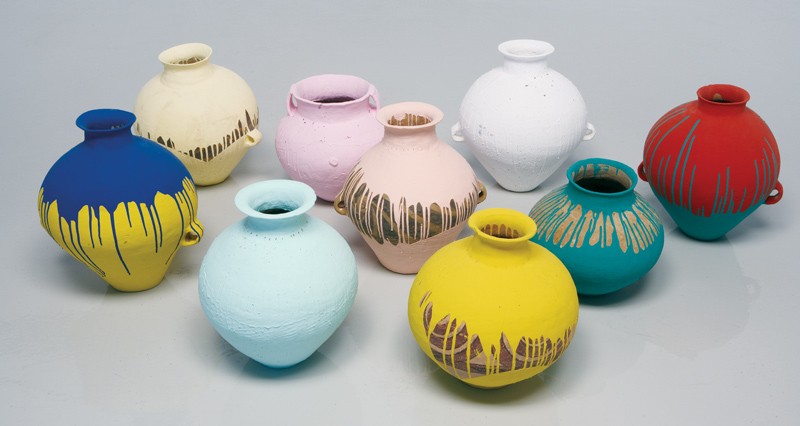
Locate an element on the screen. This screenshot has width=800, height=426. vase is located at coordinates (328, 301).